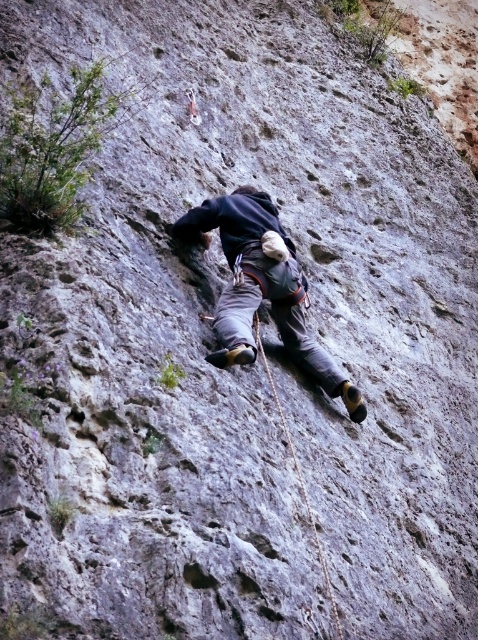
Question: Among these points, which one is nearest to the camera?

Choices:
 (A) (296, 474)
 (B) (257, 282)

Answer: (A)

Question: Which point is farther to the camera?

Choices:
 (A) (253, 198)
 (B) (294, 468)

Answer: (A)

Question: Observing the image, what is the correct spatial positioning of dark gray fabric climbing harness at center in reference to rope at center?

Choices:
 (A) above
 (B) below

Answer: (A)

Question: Does dark gray fabric climbing harness at center lie in front of rope at center?

Choices:
 (A) yes
 (B) no

Answer: (B)

Question: Can you confirm if dark gray fabric climbing harness at center is wider than rope at center?

Choices:
 (A) yes
 (B) no

Answer: (B)

Question: Which point is farther from the camera taking this photo?

Choices:
 (A) (297, 477)
 (B) (273, 212)

Answer: (B)